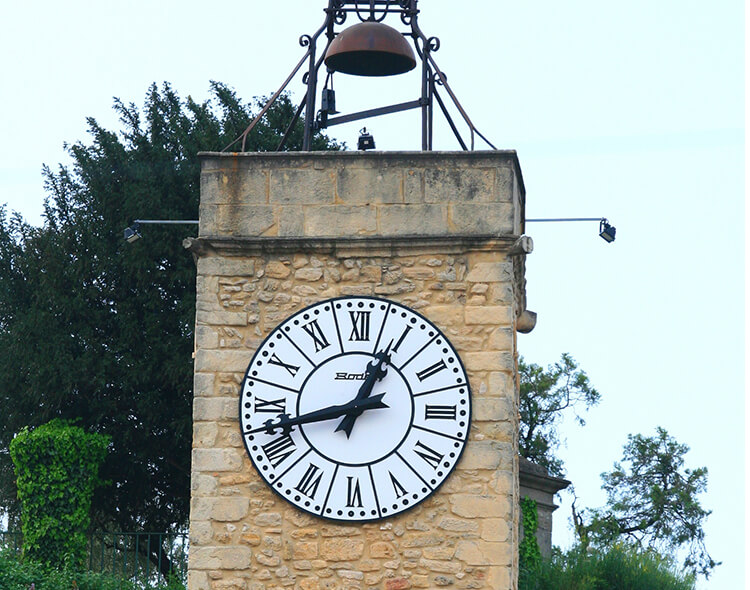
I want to click on light on the top, so click(x=367, y=140).